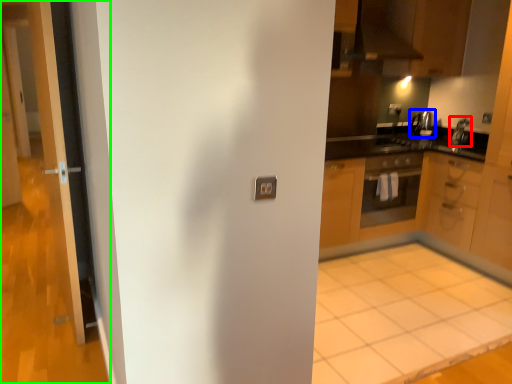
Question: Which object is positioned farthest from appliance (highlighted by a red box)? Select from appliance (highlighted by a blue box) and door (highlighted by a green box).

Choices:
 (A) appliance
 (B) door

Answer: (B)